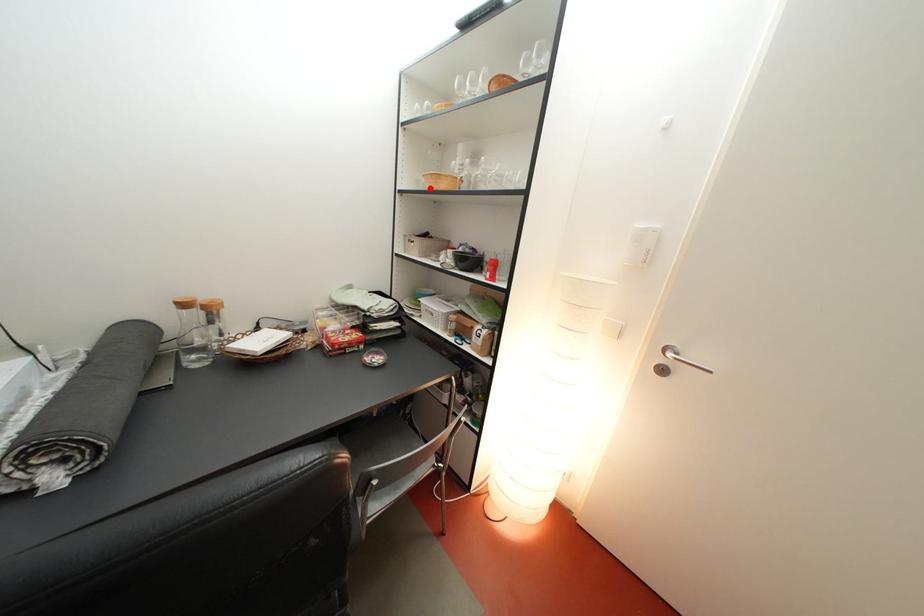
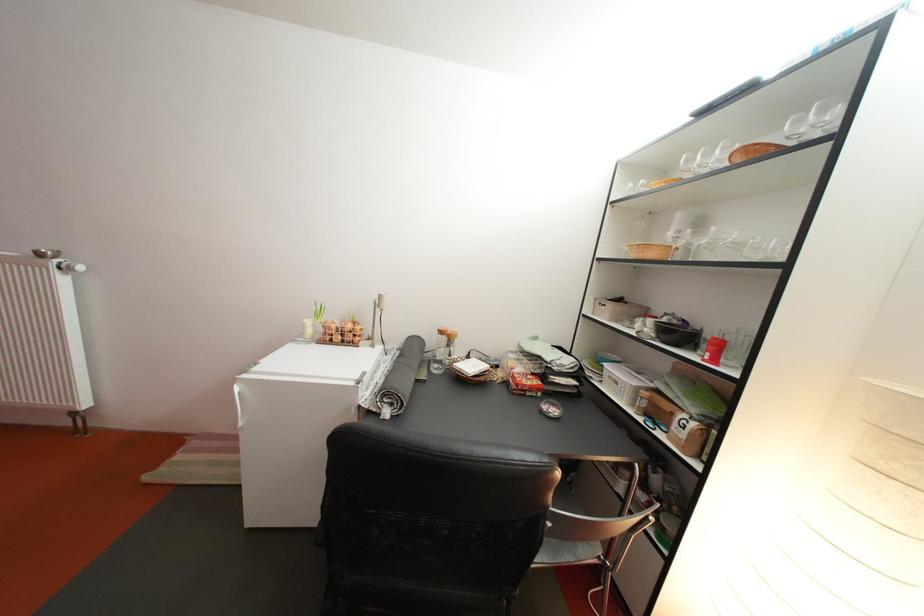
Locate, in the second image, the point that corresponds to the highlighted location in the first image.

(630, 256)